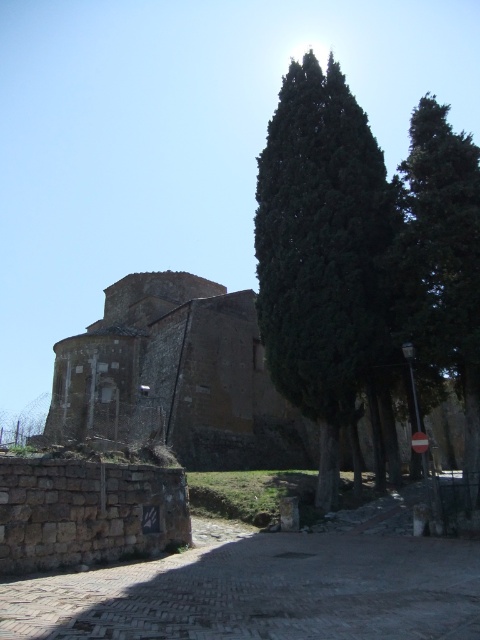
Who is lower down, green leafy tree at center or green leafy tree at right?

green leafy tree at right

Does green leafy tree at center have a smaller size compared to green leafy tree at right?

Actually, green leafy tree at center might be larger than green leafy tree at right.

Is point (351, 285) closer to viewer compared to point (443, 168)?

That is False.

The image size is (480, 640). Identify the location of green leafy tree at center. pos(324,259).